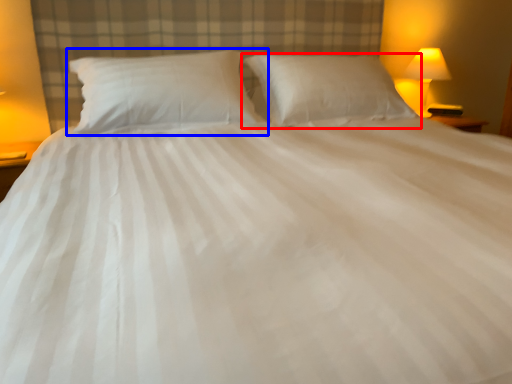
Question: Which object is further to the camera taking this photo, pillow (highlighted by a red box) or pillow (highlighted by a blue box)?

Choices:
 (A) pillow
 (B) pillow

Answer: (A)